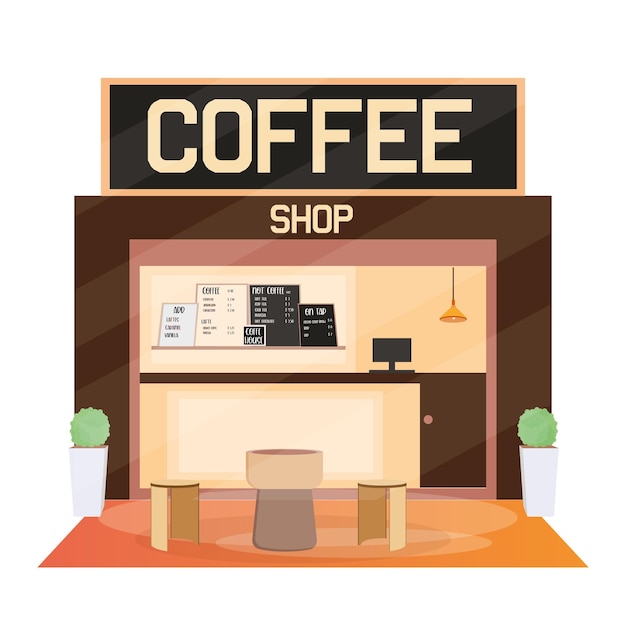
The image size is (626, 626). I want to click on door handle, so click(x=427, y=418).